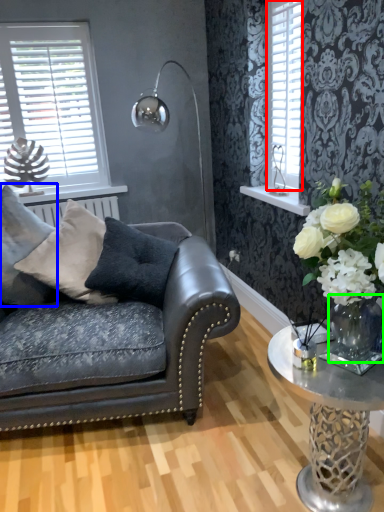
Question: Considering the real-world distances, which object is farthest from shutter (highlighted by a red box)? pillow (highlighted by a blue box) or vase (highlighted by a green box)?

Choices:
 (A) pillow
 (B) vase

Answer: (A)